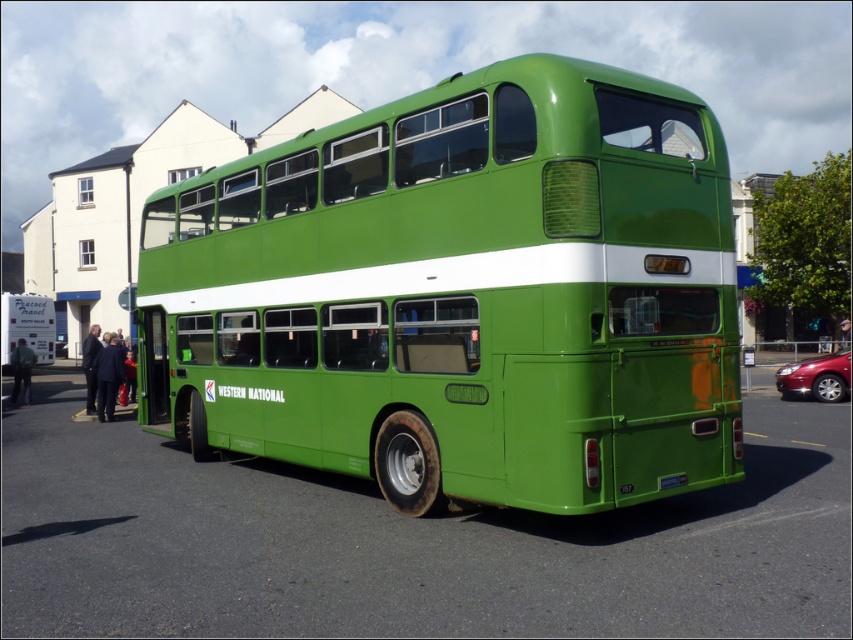
Question: Which object is the farthest from the green matte/deck bus at center?

Choices:
 (A) green plastic license plate at rear
 (B) green matte bus at center

Answer: (A)

Question: Does green matte bus at center have a greater width compared to green plastic license plate at rear?

Choices:
 (A) no
 (B) yes

Answer: (B)

Question: Observing the image, what is the correct spatial positioning of green matte bus at center in reference to green plastic license plate at rear?

Choices:
 (A) left
 (B) right

Answer: (A)

Question: Considering the real-world distances, which object is closest to the green matte/deck bus at center?

Choices:
 (A) green matte bus at center
 (B) green plastic license plate at rear

Answer: (A)

Question: Based on their relative distances, which object is nearer to the green plastic license plate at rear?

Choices:
 (A) green matte/deck bus at center
 (B) green matte bus at center

Answer: (B)

Question: Can you confirm if green matte bus at center is positioned to the left of green plastic license plate at rear?

Choices:
 (A) yes
 (B) no

Answer: (A)